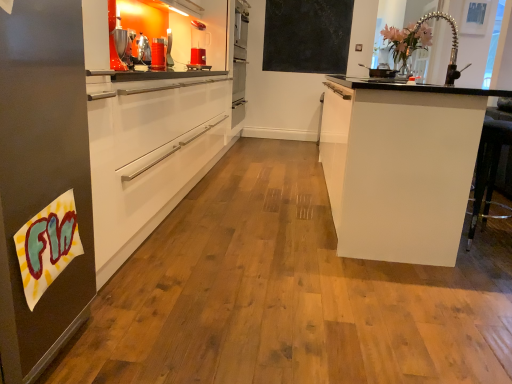
What do you see at coordinates (400, 166) in the screenshot?
I see `white glossy cabinet at right` at bounding box center [400, 166].

What is the approximate height of metallic silver coffee machine at upper left?

metallic silver coffee machine at upper left is 22.74 centimeters in height.

Identify the location of white glossy cabinet at right. The image size is (512, 384). (400, 166).

Is translucent plastic pitcher at center in contact with white glossy cabinet at right?

There is a gap between translucent plastic pitcher at center and white glossy cabinet at right.

How many degrees apart are the facing directions of translucent plastic pitcher at center and white glossy cabinet at right?

154 degrees.

Does point (192, 55) appear closer or farther from the camera than point (353, 101)?

Point (192, 55) appears to be farther away from the viewer than point (353, 101).

Image resolution: width=512 pixels, height=384 pixels. In the image, there is a translucent plastic pitcher at center. What are the coordinates of `cabinetry below it (from a real-world perspective)` in the screenshot? It's located at (400, 166).

Considering the sizes of matte black chalkboard at upper center and translucent plastic pitcher at center in the image, is matte black chalkboard at upper center taller or shorter than translucent plastic pitcher at center?

Considering their sizes, matte black chalkboard at upper center has more height than translucent plastic pitcher at center.

In the scene shown: Is matte black chalkboard at upper center not close to translucent plastic pitcher at center?

Yes, matte black chalkboard at upper center is far from translucent plastic pitcher at center.

In the scene shown: Does matte black chalkboard at upper center turn towards translucent plastic pitcher at center?

Yes, matte black chalkboard at upper center is turned towards translucent plastic pitcher at center.

What are the coordinates of `kitchen appliance lying in front of the matte black chalkboard at upper center` in the screenshot? It's located at (198, 44).

Is metallic silver coffee machine at upper left a part of matte black chalkboard at upper center?

Actually, metallic silver coffee machine at upper left is outside matte black chalkboard at upper center.

Which object is closer to the camera taking this photo, matte black chalkboard at upper center or metallic silver coffee machine at upper left?

metallic silver coffee machine at upper left is closer to the camera.

From a real-world perspective, is matte black chalkboard at upper center physically below metallic silver coffee machine at upper left?

No, from a real-world perspective, matte black chalkboard at upper center is not under metallic silver coffee machine at upper left.

Considering the sizes of objects matte black chalkboard at upper center and metallic silver coffee machine at upper left in the image provided, who is taller, matte black chalkboard at upper center or metallic silver coffee machine at upper left?

matte black chalkboard at upper center is taller.

Consider the image. From a real-world perspective, who is located lower, matte black chalkboard at upper center or white glossy cabinet at right?

From a 3D spatial view, white glossy cabinet at right is below.

Between matte black chalkboard at upper center and white glossy cabinet at right, which one has smaller width?

With smaller width is matte black chalkboard at upper center.

From the image's perspective, would you say matte black chalkboard at upper center is positioned over white glossy cabinet at right?

Correct, matte black chalkboard at upper center appears higher than white glossy cabinet at right in the image.

Between matte black chalkboard at upper center and white glossy cabinet at right, which one has smaller size?

Smaller between the two is matte black chalkboard at upper center.

I want to click on bulletin board located above the translucent plastic pitcher at center (from the image's perspective), so click(x=307, y=36).

Which object is positioned more to the left, translucent plastic pitcher at center or matte black chalkboard at upper center?

translucent plastic pitcher at center.

Considering the relative sizes of translucent plastic pitcher at center and matte black chalkboard at upper center in the image provided, is translucent plastic pitcher at center thinner than matte black chalkboard at upper center?

Incorrect, the width of translucent plastic pitcher at center is not less than that of matte black chalkboard at upper center.

What's the angular difference between translucent plastic pitcher at center and matte black chalkboard at upper center's facing directions?

64.3 degrees.

In terms of height, does translucent plastic pitcher at center look taller or shorter compared to metallic silver coffee machine at upper left?

translucent plastic pitcher at center is taller than metallic silver coffee machine at upper left.

In terms of width, does translucent plastic pitcher at center look wider or thinner when compared to metallic silver coffee machine at upper left?

translucent plastic pitcher at center is wider than metallic silver coffee machine at upper left.

Which is more to the left, translucent plastic pitcher at center or metallic silver coffee machine at upper left?

Positioned to the left is metallic silver coffee machine at upper left.

Which is in front, translucent plastic pitcher at center or metallic silver coffee machine at upper left?

metallic silver coffee machine at upper left is more forward.

Considering the relative positions of white glossy cabinet at right and translucent plastic pitcher at center in the image provided, is white glossy cabinet at right in front of translucent plastic pitcher at center?

Yes, the depth of white glossy cabinet at right is less than that of translucent plastic pitcher at center.

Which of these two, white glossy cabinet at right or translucent plastic pitcher at center, is bigger?

With larger size is white glossy cabinet at right.

From the picture: From a real-world perspective, relative to translucent plastic pitcher at center, is white glossy cabinet at right vertically above or below?

From a real-world perspective, white glossy cabinet at right is physically below translucent plastic pitcher at center.

Between white glossy cabinet at right and translucent plastic pitcher at center, which one has smaller width?

translucent plastic pitcher at center is thinner.

I want to click on kitchen appliance that is on the left side of white glossy cabinet at right, so click(198, 44).

Where is `kitchen appliance beneath the matte black chalkboard at upper center (from a real-world perspective)`? kitchen appliance beneath the matte black chalkboard at upper center (from a real-world perspective) is located at coordinates (x=198, y=44).

Which object lies further to the anchor point matte black chalkboard at upper center, metallic silver coffee machine at upper left or translucent plastic pitcher at center?

metallic silver coffee machine at upper left.

Looking at the image, which one is located closer to matte black chalkboard at upper center, translucent plastic pitcher at center or metallic silver coffee machine at upper left?

translucent plastic pitcher at center lies closer to matte black chalkboard at upper center than the other object.

Estimate the real-world distances between objects in this image. Which object is further from translucent plastic pitcher at center, metallic silver coffee machine at upper left or white glossy cabinet at right?

The object further to translucent plastic pitcher at center is white glossy cabinet at right.

Based on their spatial positions, is matte black chalkboard at upper center or translucent plastic pitcher at center further from metallic silver coffee machine at upper left?

Based on the image, matte black chalkboard at upper center appears to be further to metallic silver coffee machine at upper left.

Based on their spatial positions, is metallic silver coffee machine at upper left or white glossy cabinet at right closer to matte black chalkboard at upper center?

metallic silver coffee machine at upper left is positioned closer to the anchor matte black chalkboard at upper center.

Estimate the real-world distances between objects in this image. Which object is closer to white glossy cabinet at right, translucent plastic pitcher at center or matte black chalkboard at upper center?

translucent plastic pitcher at center is closer to white glossy cabinet at right.

Which object lies further to the anchor point metallic silver coffee machine at upper left, translucent plastic pitcher at center or matte black chalkboard at upper center?

matte black chalkboard at upper center.

Based on their spatial positions, is matte black chalkboard at upper center or white glossy cabinet at right further from metallic silver coffee machine at upper left?

matte black chalkboard at upper center.

Where is `kitchen appliance between white glossy cabinet at right and matte black chalkboard at upper center from front to back`? kitchen appliance between white glossy cabinet at right and matte black chalkboard at upper center from front to back is located at coordinates (198, 44).

I want to click on appliance positioned between white glossy cabinet at right and matte black chalkboard at upper center from near to far, so click(x=158, y=54).

You are a GUI agent. You are given a task and a screenshot of the screen. Output one action in this format:
    pyautogui.click(x=<x>, y=<y>)
    Task: Click on the appliance positioned between white glossy cabinet at right and translucent plastic pitcher at center from near to far
    Image resolution: width=512 pixels, height=384 pixels.
    Given the screenshot: What is the action you would take?
    pyautogui.click(x=158, y=54)

Image resolution: width=512 pixels, height=384 pixels. In order to click on kitchen appliance between metallic silver coffee machine at upper left and matte black chalkboard at upper center in the front-back direction in this screenshot , I will do `click(198, 44)`.